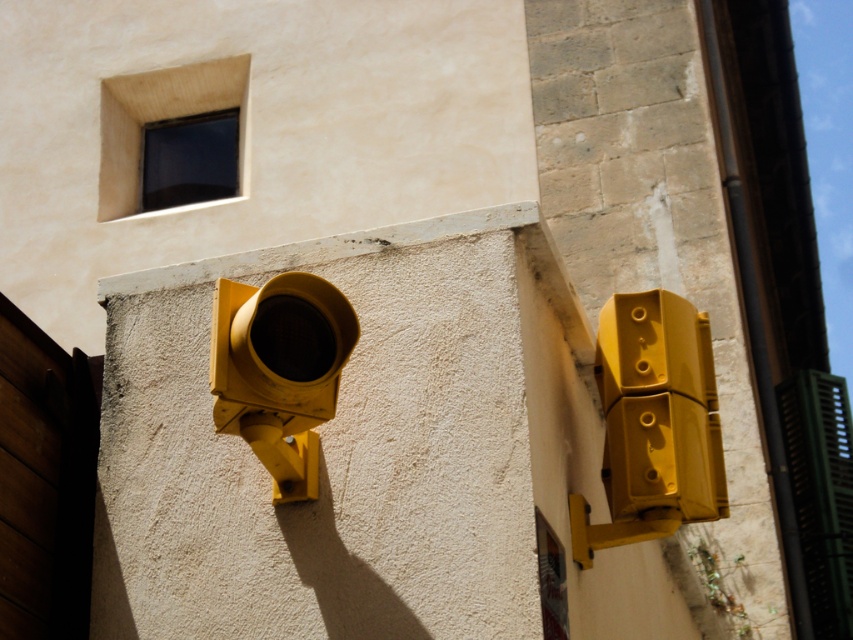
Question: Among these points, which one is nearest to the camera?

Choices:
 (A) (619, 444)
 (B) (320, 397)

Answer: (B)

Question: Does matte yellow traffic light at right lie behind matte yellow traffic light at left?

Choices:
 (A) yes
 (B) no

Answer: (A)

Question: Which object appears farthest from the camera in this image?

Choices:
 (A) matte yellow traffic light at right
 (B) matte yellow traffic light at left

Answer: (A)

Question: Does matte yellow traffic light at right come behind matte yellow traffic light at left?

Choices:
 (A) no
 (B) yes

Answer: (B)

Question: Does matte yellow traffic light at right appear on the left side of matte yellow traffic light at left?

Choices:
 (A) no
 (B) yes

Answer: (A)